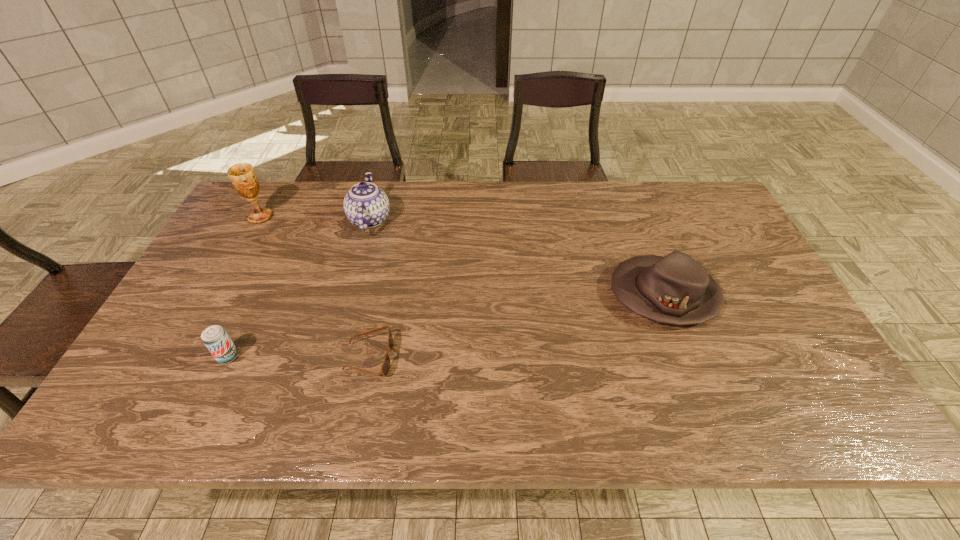
The width and height of the screenshot is (960, 540). Identify the location of vacant space at the near edge of the desktop. (454, 407).

The height and width of the screenshot is (540, 960). I want to click on vacant space at the left edge of the desktop, so click(252, 239).

I want to click on free space at the right edge of the desktop, so click(718, 238).

You are a GUI agent. You are given a task and a screenshot of the screen. Output one action in this format:
    pyautogui.click(x=<x>, y=<y>)
    Task: Click on the vacant area at the far left corner
    
    Given the screenshot: What is the action you would take?
    pyautogui.click(x=239, y=212)

Where is `free space at the near left corner`? Image resolution: width=960 pixels, height=540 pixels. free space at the near left corner is located at coordinates (157, 410).

Where is `vacant region at the far right corner of the desktop`? Image resolution: width=960 pixels, height=540 pixels. vacant region at the far right corner of the desktop is located at coordinates [x=696, y=184].

I want to click on vacant region at the near right corner, so click(786, 411).

Locate an element on the screen. The width and height of the screenshot is (960, 540). unoccupied area between the hat and the second tallest object is located at coordinates (516, 257).

You are a GUI agent. You are given a task and a screenshot of the screen. Output one action in this format:
    pyautogui.click(x=<x>, y=<y>)
    Task: Click on the vacant point located between the tallest object and the rightmost object
    The width and height of the screenshot is (960, 540).
    Given the screenshot: What is the action you would take?
    pyautogui.click(x=462, y=256)

Identify the location of vacant area that lies between the chalice and the shortest object. The height and width of the screenshot is (540, 960). pyautogui.click(x=315, y=287).